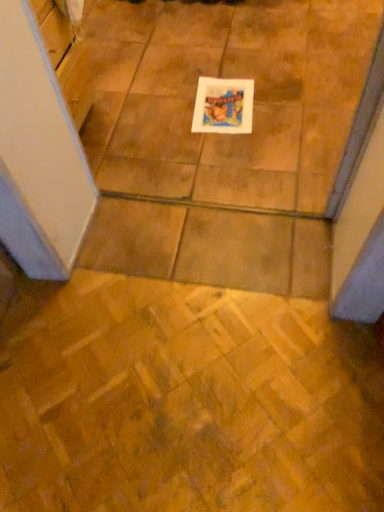
You are a GUI agent. You are given a task and a screenshot of the screen. Output one action in this format:
    pyautogui.click(x=<x>, y=<y>)
    Task: Click on the free space on the front side of white paper at center
    This screenshot has height=512, width=384.
    Given the screenshot: What is the action you would take?
    pyautogui.click(x=235, y=153)